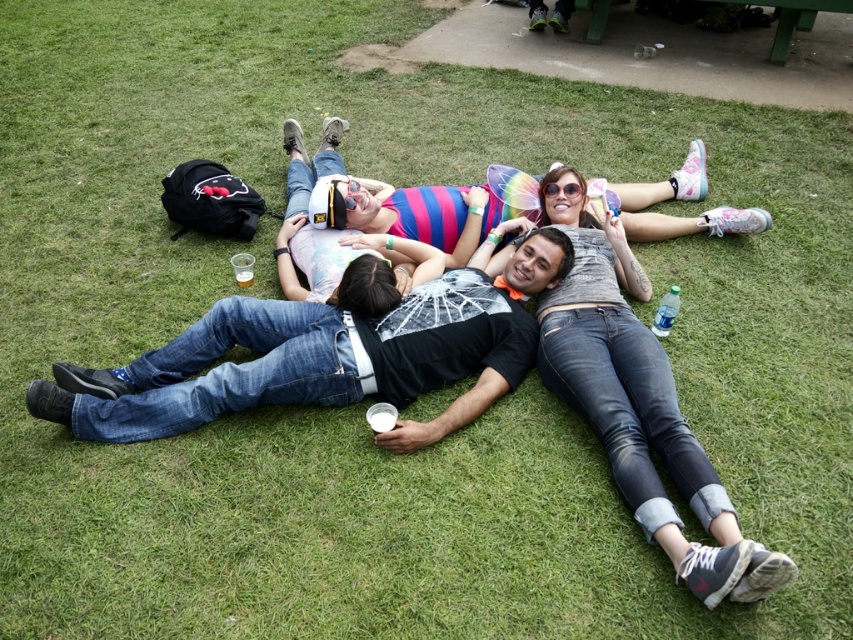
Question: Which object is the farthest from the denim jeans at center?

Choices:
 (A) translucent plastic cup at center
 (B) jeans at center

Answer: (A)

Question: Considering the relative positions of denim jeans at center and translucent plastic cup at center in the image provided, where is denim jeans at center located with respect to translucent plastic cup at center?

Choices:
 (A) left
 (B) right

Answer: (B)

Question: Considering the real-world distances, which object is farthest from the jeans at center?

Choices:
 (A) denim jeans at center
 (B) translucent plastic cup at center

Answer: (B)

Question: Among these objects, which one is nearest to the camera?

Choices:
 (A) denim jeans at center
 (B) translucent plastic cup at center
 (C) jeans at center

Answer: (A)

Question: Does jeans at center have a larger size compared to denim jeans at center?

Choices:
 (A) yes
 (B) no

Answer: (A)

Question: In this image, where is jeans at center located relative to denim jeans at center?

Choices:
 (A) right
 (B) left

Answer: (B)